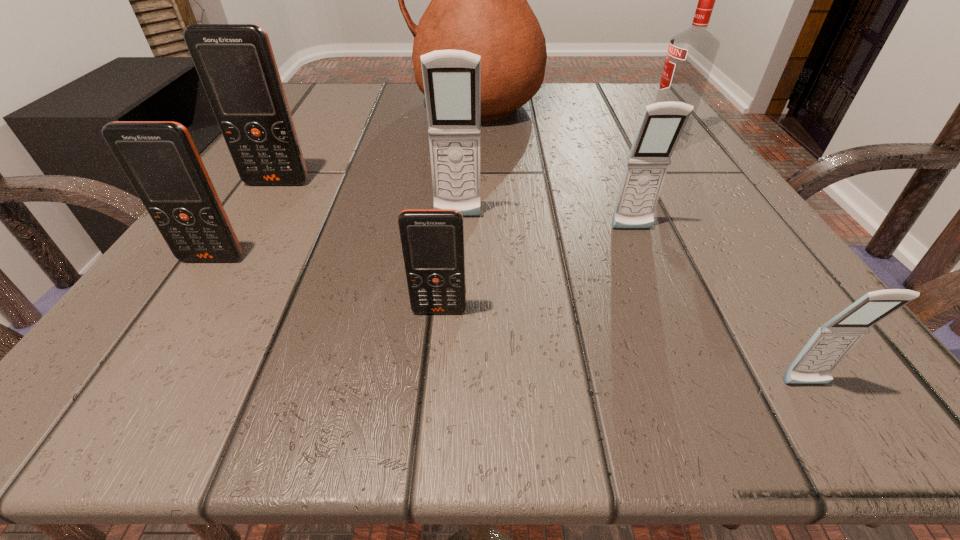
Find the location of a particular element. the smallest orange cellular telephone is located at coordinates (432, 240).

Locate an element on the screen. The height and width of the screenshot is (540, 960). the nearest orange cellular telephone is located at coordinates (432, 240).

Image resolution: width=960 pixels, height=540 pixels. Find the location of `the smallest gray cellular telephone`. the smallest gray cellular telephone is located at coordinates (830, 344).

I want to click on the nearest object, so click(x=830, y=344).

Image resolution: width=960 pixels, height=540 pixels. In order to click on vacant space located on the side of the tallest object with the handle in this screenshot , I will do `click(350, 105)`.

Where is `blank space located 0.120m on the side of the tallest object with the handle`? blank space located 0.120m on the side of the tallest object with the handle is located at coordinates (350, 105).

Where is `free spot located 0.220m on the side of the tallest object with the handle`? The height and width of the screenshot is (540, 960). free spot located 0.220m on the side of the tallest object with the handle is located at coordinates (302, 105).

The width and height of the screenshot is (960, 540). I want to click on free space located on the front label of the red vodka, so click(434, 142).

Locate an element on the screen. free spot located 0.150m on the front label of the red vodka is located at coordinates (562, 142).

Where is `vacant space located on the front label of the red vodka`? This screenshot has height=540, width=960. vacant space located on the front label of the red vodka is located at coordinates click(x=606, y=142).